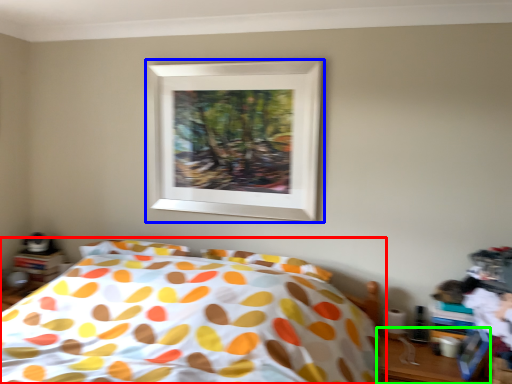
Question: Which is nearer to the bed (highlighted by a red box)? picture frame (highlighted by a blue box) or table (highlighted by a green box).

Choices:
 (A) picture frame
 (B) table

Answer: (A)